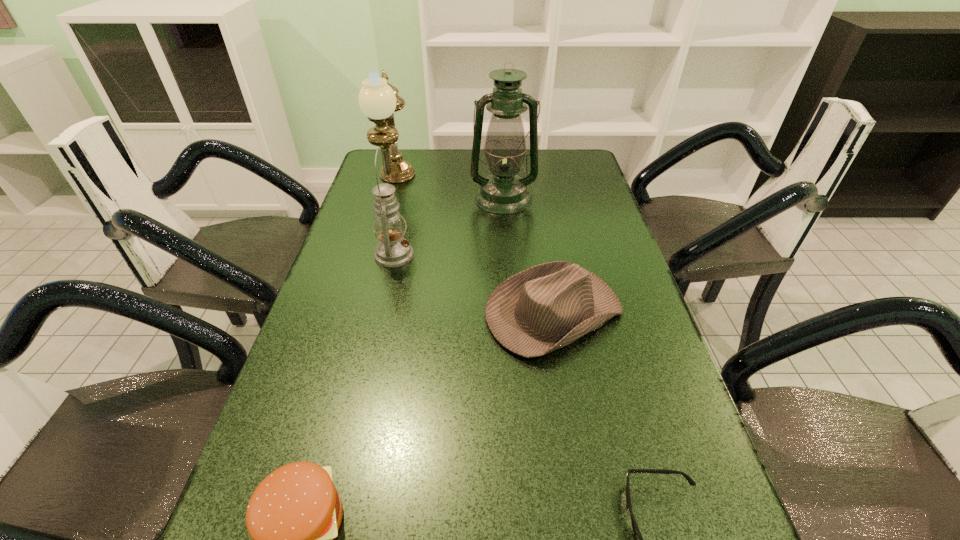
Locate an element on the screen. the rightmost oil lamp is located at coordinates [x=503, y=192].

This screenshot has width=960, height=540. In order to click on the shortest oil lamp in this screenshot , I will do `click(393, 250)`.

Image resolution: width=960 pixels, height=540 pixels. Identify the location of the third farthest object. (393, 250).

The width and height of the screenshot is (960, 540). Find the location of `the fourth tallest object`. the fourth tallest object is located at coordinates (546, 307).

The width and height of the screenshot is (960, 540). Find the location of `fedora`. fedora is located at coordinates (546, 307).

In order to click on vacant point located 0.180m on the front of the rightmost oil lamp in this screenshot , I will do `click(507, 251)`.

You are a GUI agent. You are given a task and a screenshot of the screen. Output one action in this format:
    pyautogui.click(x=<x>, y=<y>)
    Task: Click on the vacant region located on the back of the shortest oil lamp
    The height and width of the screenshot is (540, 960).
    Given the screenshot: What is the action you would take?
    pyautogui.click(x=410, y=187)

The image size is (960, 540). I want to click on free space located on the back of the fedora, so (536, 204).

Identify the location of object at the far edge. This screenshot has width=960, height=540. (378, 99).

Identify the location of object present at the right edge. (546, 307).